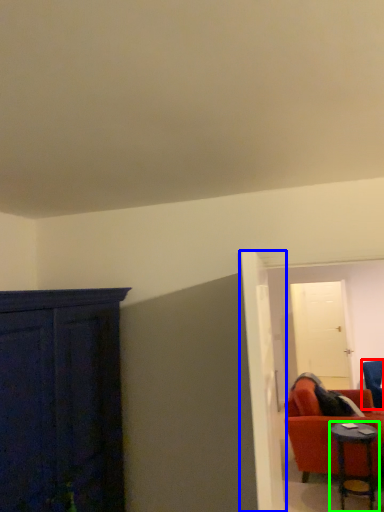
Question: Which is farther away from chair (highlighted by a red box)? door (highlighted by a blue box) or table (highlighted by a green box)?

Choices:
 (A) door
 (B) table

Answer: (A)